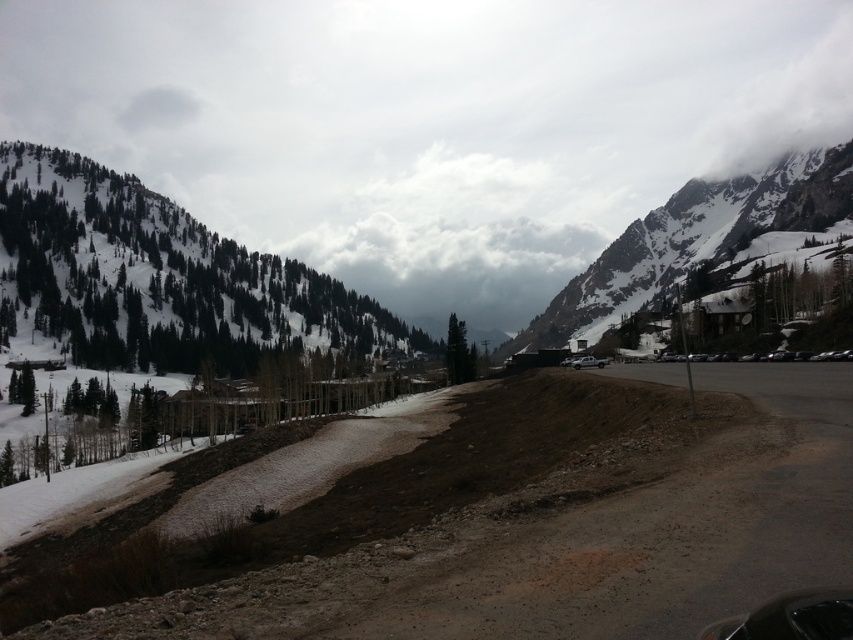
Based on the photo, you are a hiker planning to take a photo of the brown dirt track at center and the snowy evergreen forest at upper left. Which object should you position to the right side of your camera frame to capture both in the scene?

To capture both the brown dirt track at center and the snowy evergreen forest at upper left in your camera frame, you should position the brown dirt track at center to the right side of your frame since it is already located to the right of the snowy evergreen forest at upper left in the scene.

You are standing at the point marked by point (572, 545) in the image. Looking around, you see a brown dirt track at center. Which direction should you walk to stay on the dirt track leading towards the parking area?

The point (572, 545) is on the brown dirt track at center, so walking forward along the track would keep you on the path leading towards the parking area.